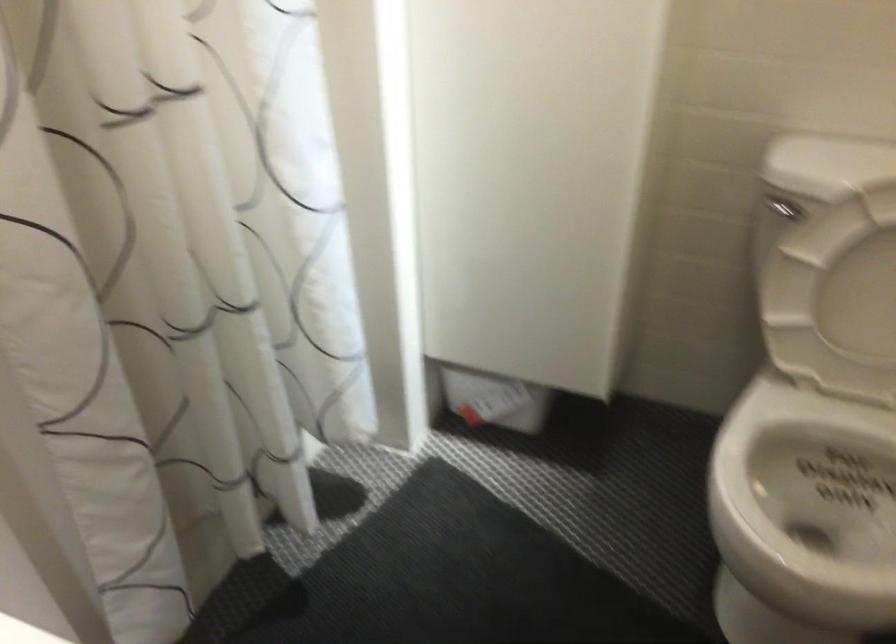
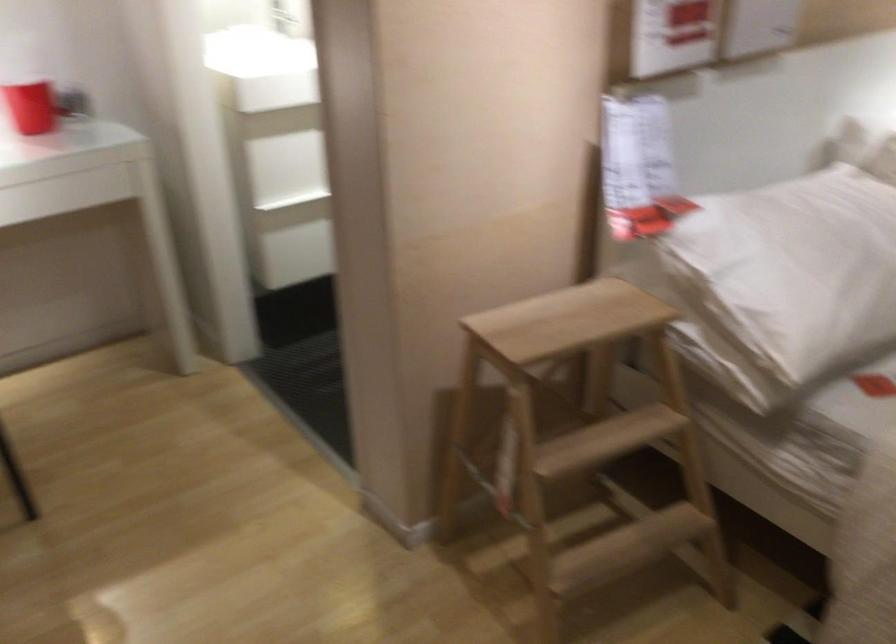
Question: I am providing you with two images of the same scene from different viewpoints. Which of the following objects are not visible in image2?

Choices:
 (A) red cup
 (B) sofa seat
 (C) white toilet seat
 (D) wooden step stool

Answer: (C)